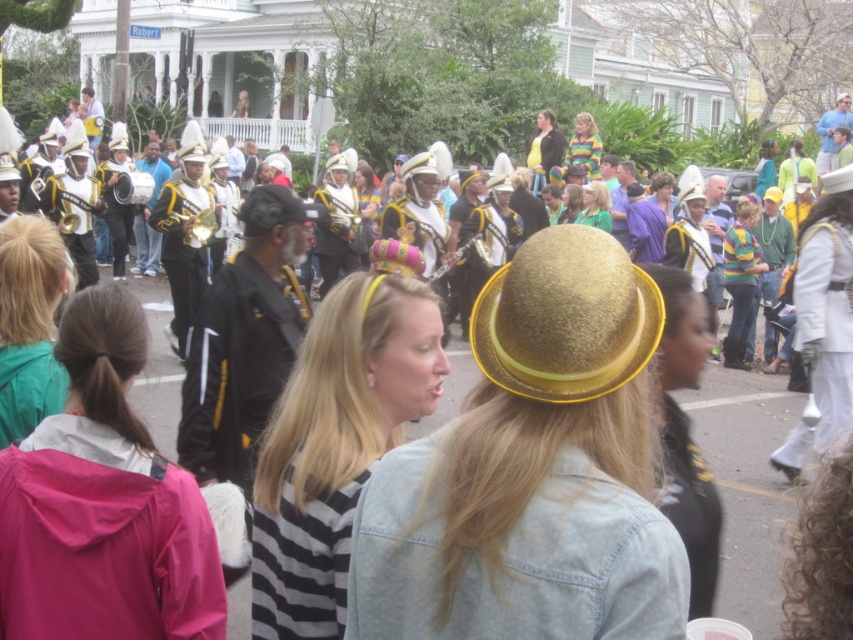
Question: Is striped fabric headband at center above matte gold crown at center?

Choices:
 (A) no
 (B) yes

Answer: (A)

Question: Is striped fabric headband at center below striped shirt at upper right?

Choices:
 (A) no
 (B) yes

Answer: (B)

Question: Estimate the real-world distances between objects in this image. Which object is closer to the striped fabric headband at center?

Choices:
 (A) striped shirt at upper right
 (B) matte gold crown at center

Answer: (B)

Question: Which point is closer to the camera?

Choices:
 (A) (587, 172)
 (B) (646, 317)

Answer: (B)

Question: Among these points, which one is farthest from the camera?

Choices:
 (A) (607, 196)
 (B) (637, 484)
 (C) (503, 372)

Answer: (A)

Question: Is teal fabric jacket at center bigger than striped shirt at upper right?

Choices:
 (A) yes
 (B) no

Answer: (B)